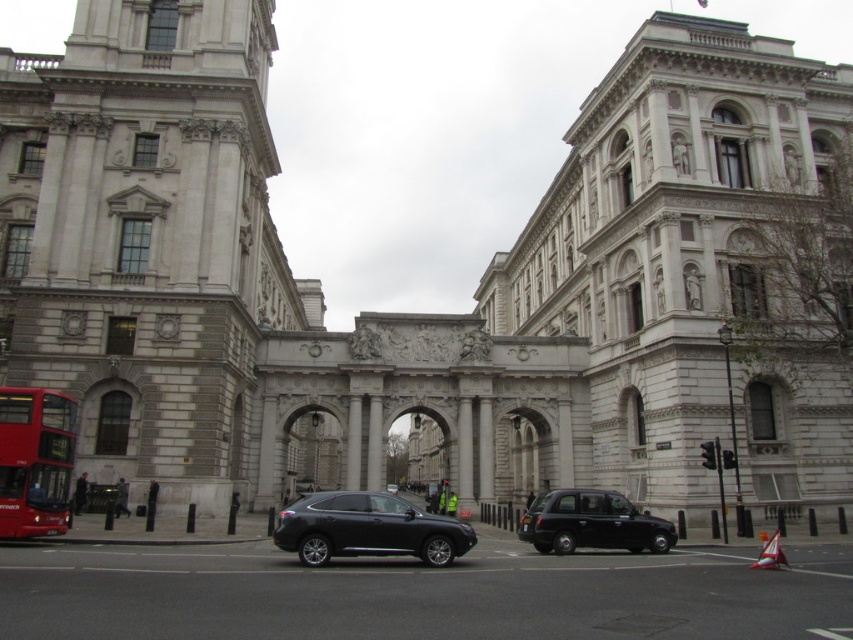
What do you see at coordinates (367, 529) in the screenshot?
I see `shiny black suv at center` at bounding box center [367, 529].

Between shiny black suv at center and red metallic bus at lower left, which one appears on the right side from the viewer's perspective?

shiny black suv at center is more to the right.

Locate an element on the screen. This screenshot has height=640, width=853. shiny black suv at center is located at coordinates (367, 529).

Is point (346, 541) farther from camera compared to point (564, 497)?

No, it is in front of (564, 497).

Can you confirm if shiny black suv at center is taller than black metallic taxi at center?

Indeed, shiny black suv at center has a greater height compared to black metallic taxi at center.

The image size is (853, 640). What do you see at coordinates (367, 529) in the screenshot?
I see `shiny black suv at center` at bounding box center [367, 529].

Find the location of a particular element. This screenshot has width=853, height=640. shiny black suv at center is located at coordinates (367, 529).

Is red metallic bus at lower left smaller than black metallic taxi at center?

Yes, red metallic bus at lower left is smaller than black metallic taxi at center.

Which is more to the left, red metallic bus at lower left or black metallic taxi at center?

Positioned to the left is red metallic bus at lower left.

Between point (56, 454) and point (601, 516), which one is positioned in front?

Point (56, 454) is more forward.

Image resolution: width=853 pixels, height=640 pixels. Identify the location of red metallic bus at lower left. (33, 461).